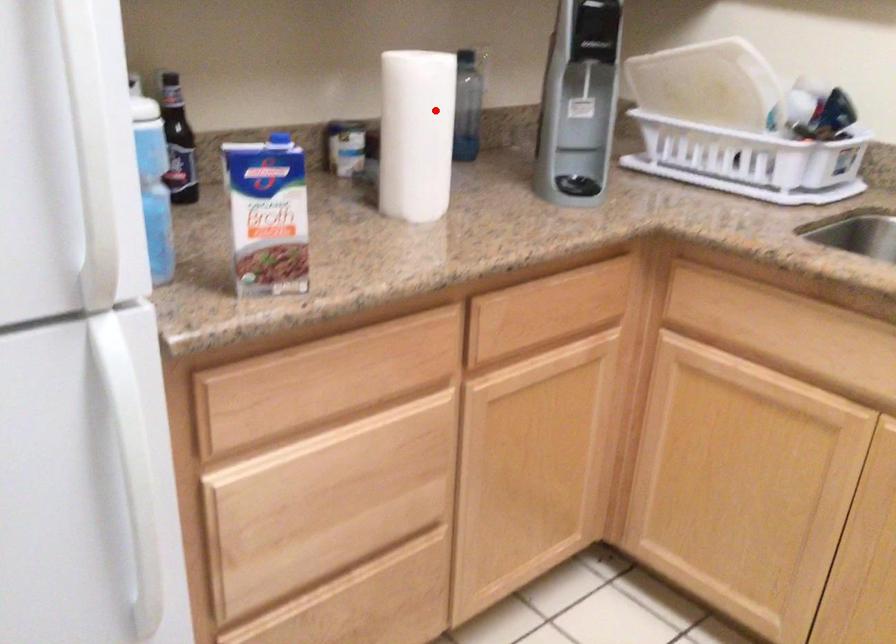
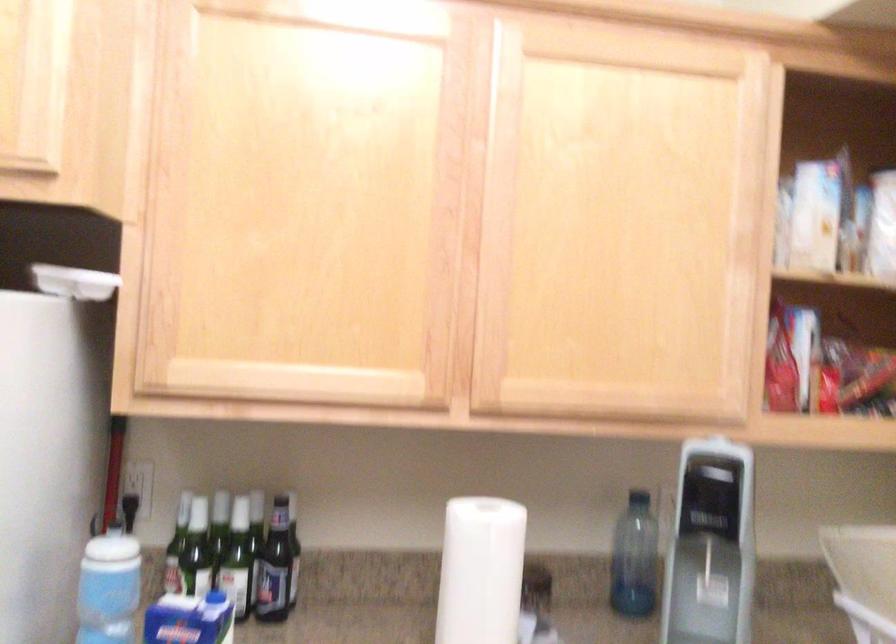
Locate, in the second image, the point that corresponds to the highlighted location in the first image.

(479, 571)